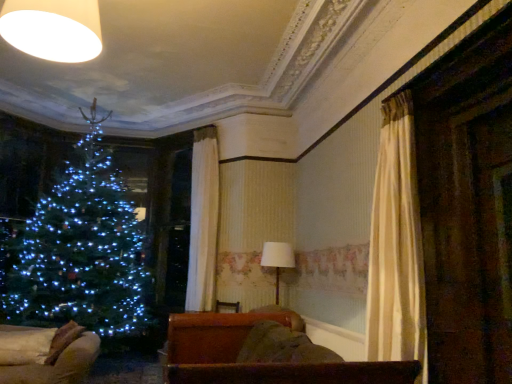
Question: Does brown leather couch at lower center, the second furniture viewed from the left, have a lesser height compared to white fabric lampshade at center?

Choices:
 (A) no
 (B) yes

Answer: (B)

Question: Is brown leather couch at lower center, which appears as the second furniture when viewed from the back, behind white fabric lampshade at center?

Choices:
 (A) yes
 (B) no

Answer: (B)

Question: Can you confirm if brown leather couch at lower center, which appears as the second furniture when viewed from the back, is wider than white fabric lampshade at center?

Choices:
 (A) no
 (B) yes

Answer: (B)

Question: Is brown leather couch at lower center, which appears as the second furniture when viewed from the back, at the right side of white fabric lampshade at center?

Choices:
 (A) yes
 (B) no

Answer: (B)

Question: Considering the relative sizes of brown leather couch at lower center, the second furniture viewed from the left, and white fabric lampshade at center in the image provided, is brown leather couch at lower center, the second furniture viewed from the left, thinner than white fabric lampshade at center?

Choices:
 (A) yes
 (B) no

Answer: (B)

Question: From the image's perspective, is brown leather couch at lower center, which ranks as the 1th furniture in right-to-left order, below white fabric lampshade at center?

Choices:
 (A) no
 (B) yes

Answer: (A)

Question: Is white fabric lampshade at center to the left of velvet beige sofa at lower left, the first furniture positioned from the back, from the viewer's perspective?

Choices:
 (A) yes
 (B) no

Answer: (B)

Question: Can you confirm if white fabric lampshade at center is bigger than velvet beige sofa at lower left, the first furniture positioned from the back?

Choices:
 (A) yes
 (B) no

Answer: (B)

Question: From the image's perspective, would you say white fabric lampshade at center is positioned over velvet beige sofa at lower left, the 2th furniture positioned from the right?

Choices:
 (A) yes
 (B) no

Answer: (A)

Question: Is white fabric lampshade at center directly adjacent to velvet beige sofa at lower left, the 2th furniture positioned from the right?

Choices:
 (A) no
 (B) yes

Answer: (A)

Question: From the image's perspective, does white fabric lampshade at center appear lower than velvet beige sofa at lower left, which appears as the first furniture when viewed from the left?

Choices:
 (A) yes
 (B) no

Answer: (B)

Question: Is white fabric lampshade at center wider than velvet beige sofa at lower left, which appears as the second furniture when viewed from the front?

Choices:
 (A) yes
 (B) no

Answer: (B)

Question: From the image's perspective, is white fabric lampshade at center below brown leather couch at lower center, the second furniture viewed from the left?

Choices:
 (A) no
 (B) yes

Answer: (B)